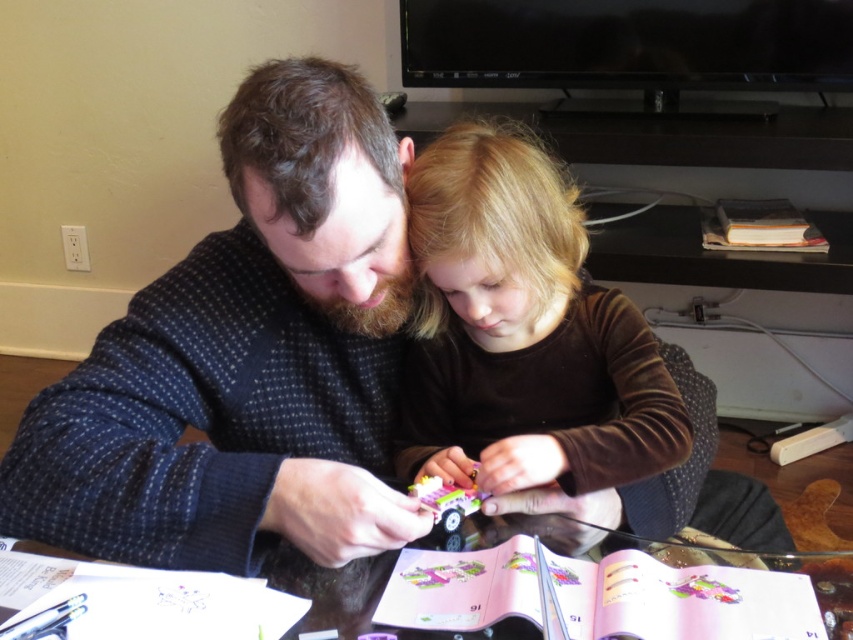
You are a guest in this living room and want to place a small plant on the transparent glass table at center. However, you notice the hardcover book at upper right nearby. Can the plant fit on the table without being blocked by the book?

The transparent glass table at center is not as tall as the hardcover book at upper right, meaning the book is taller. Since the book is taller, placing the plant on the table might be blocked by the book if they are positioned close. Ensure there is enough space between them for visibility.

You are a guest in this living room and want to sit down on the transparent glass table at center. However, there is a brown velvet shirt at center on it. Can you sit there comfortably?

The brown velvet shirt at center is positioned over transparent glass table at center, so you can sit on the transparent glass table at center as the shirt is likely just resting on it and can be moved aside.